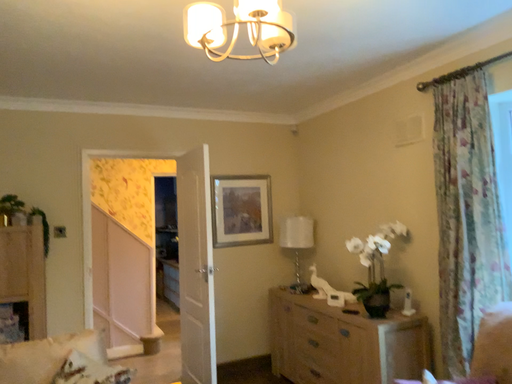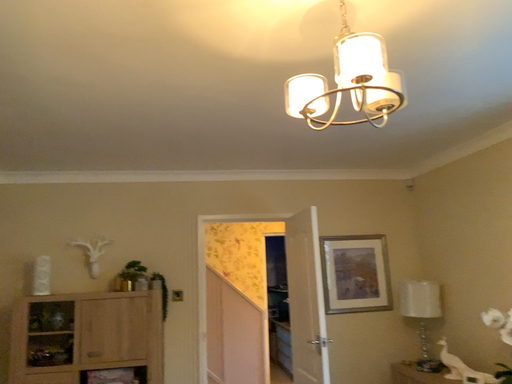
Question: Which way did the camera rotate in the video?

Choices:
 (A) rotated left
 (B) rotated right

Answer: (A)